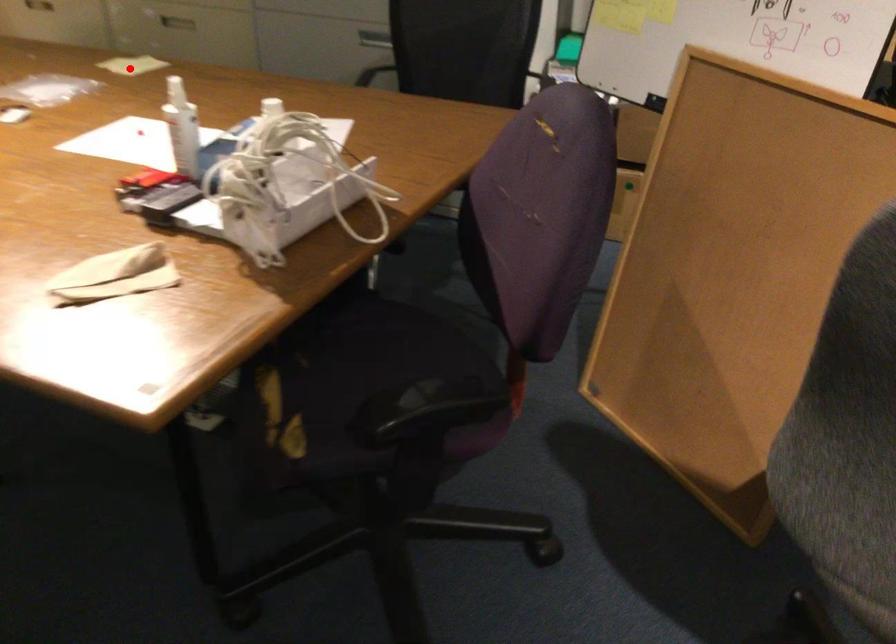
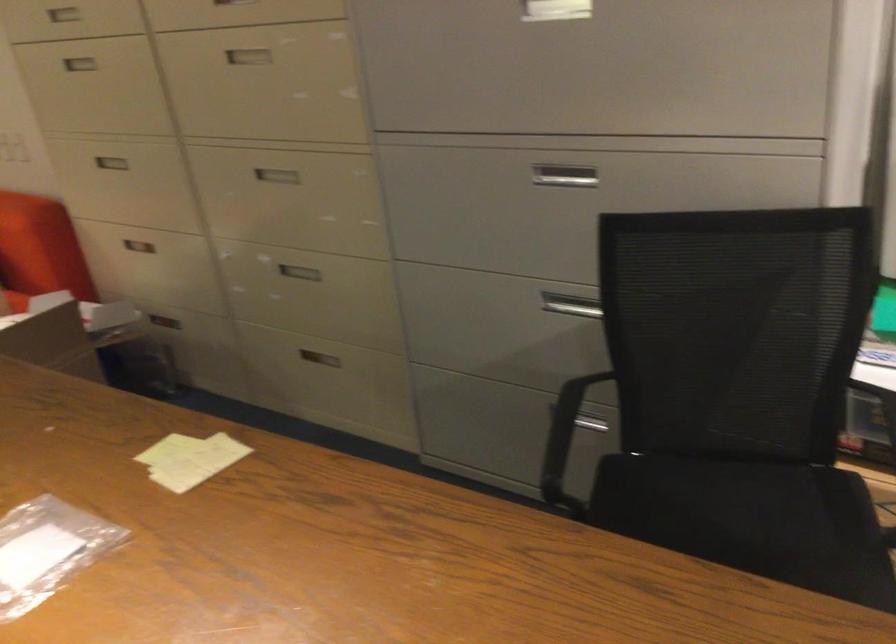
The point at the highlighted location is marked in the first image. Where is the corresponding point in the second image?

(190, 459)